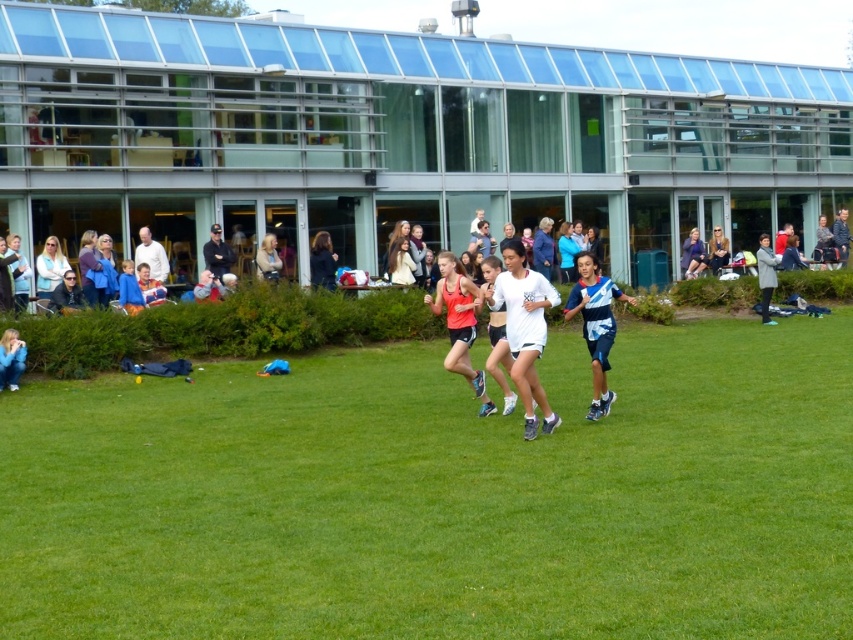
Question: Is blue striped shirt at center smaller than blue denim jacket at center?

Choices:
 (A) yes
 (B) no

Answer: (A)

Question: Does blue striped shirt at center have a greater width compared to dark blue jacket at center?

Choices:
 (A) yes
 (B) no

Answer: (B)

Question: Which point appears farthest from the camera in this image?

Choices:
 (A) (16, 360)
 (B) (334, 260)
 (C) (439, 300)

Answer: (B)

Question: Does white matte tank top at center appear over dark blue jacket at center?

Choices:
 (A) no
 (B) yes

Answer: (A)

Question: Which point is closer to the camera taking this photo?

Choices:
 (A) (9, 349)
 (B) (276, 266)
 (C) (334, 285)
 (D) (505, 310)

Answer: (D)

Question: Which of the following is the closest to the observer?

Choices:
 (A) gray wool coat at center
 (B) green grass at center
 (C) light brown hair at center
 (D) dark blue jacket at center

Answer: (B)